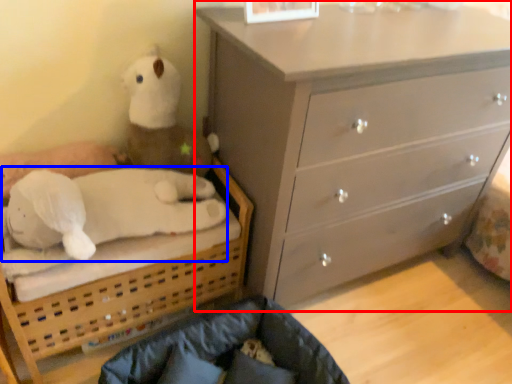
Question: Which point is closer to the camera, chest of drawers (highlighted by a red box) or animal (highlighted by a blue box)?

Choices:
 (A) chest of drawers
 (B) animal

Answer: (A)